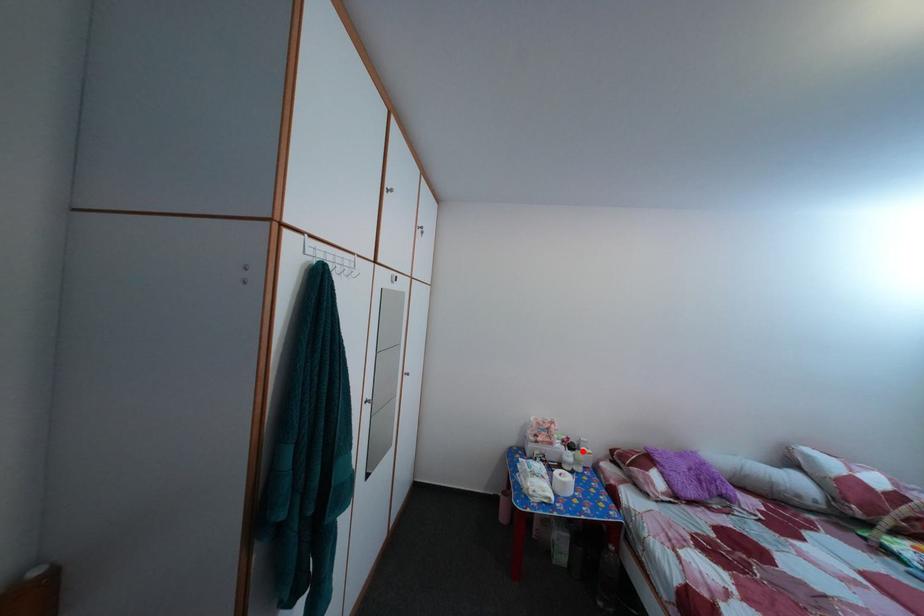
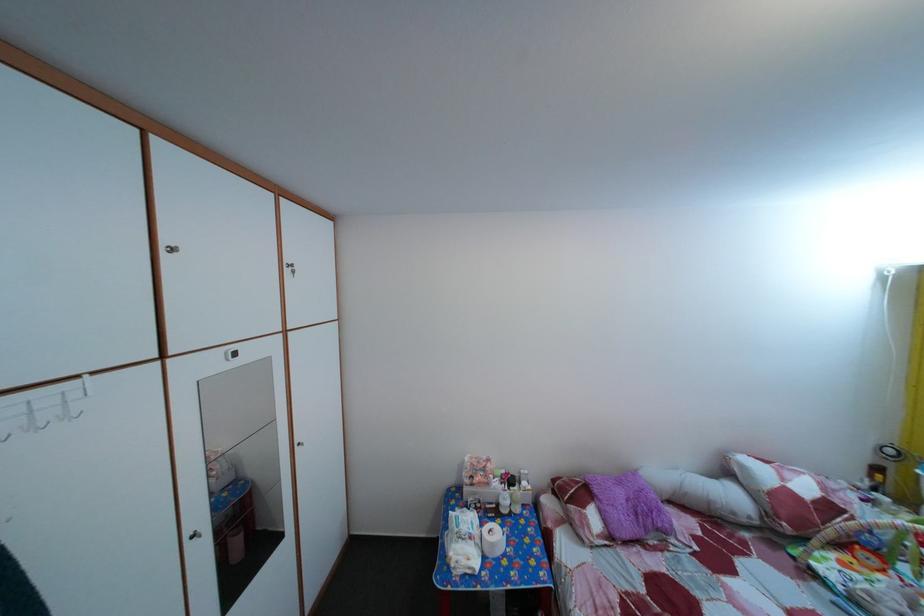
The point at the highlighted location is marked in the first image. Where is the corresponding point in the second image?

(524, 485)